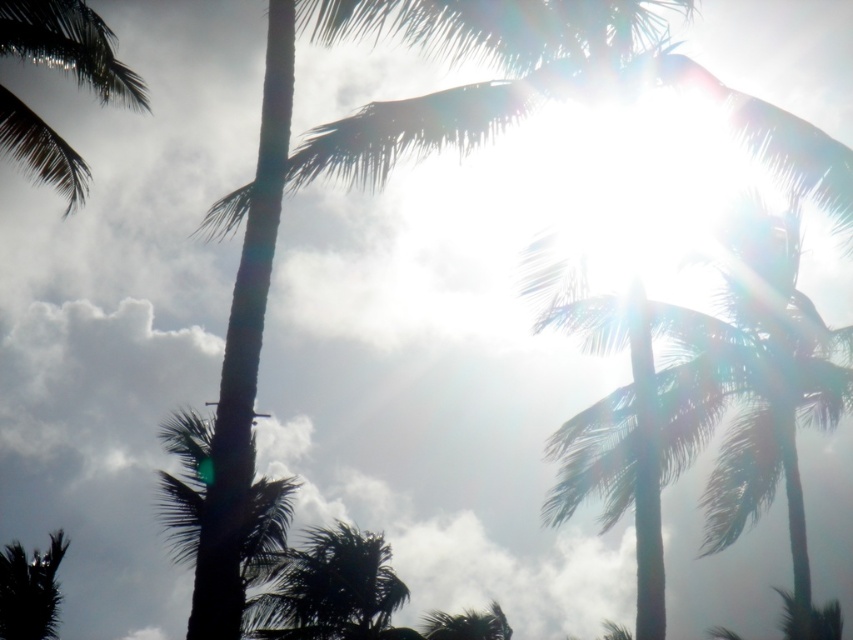
You are a bird looking for a higher perch. You see the green leafy coconut tree at upper center and the green leafy palm tree at upper left. Which tree should you choose to reach a higher position?

The green leafy coconut tree at upper center is much taller than the green leafy palm tree at upper left, so you should choose the green leafy coconut tree at upper center to reach a higher position.

You are an artist trying to paint the tropical scene. You notice the green leafy coconut tree at upper center and the green leafy palm tree at upper left. Which tree has a larger width in the painting?

The green leafy coconut tree at upper center might be wider than green leafy palm tree at upper left according to the description.

You are a photographer trying to capture the sun in your shot. You have two palm trees in view, the silhouette leafy palm at bottom left and the green leafy palm tree at lower center. Which palm tree would block the sun less if you position it between the sun and your camera?

The green leafy palm tree at lower center would block the sun less because it is smaller in size compared to the silhouette leafy palm at bottom left.